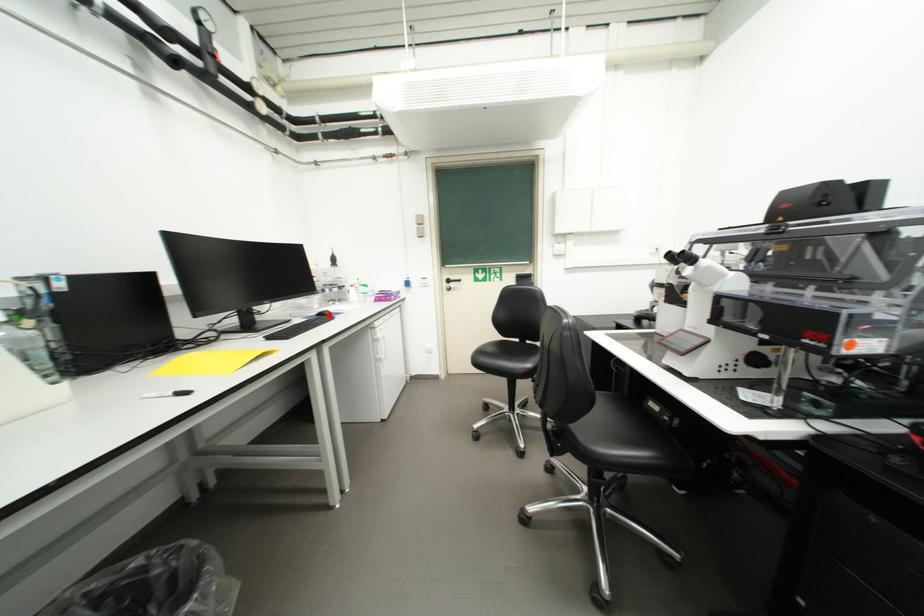
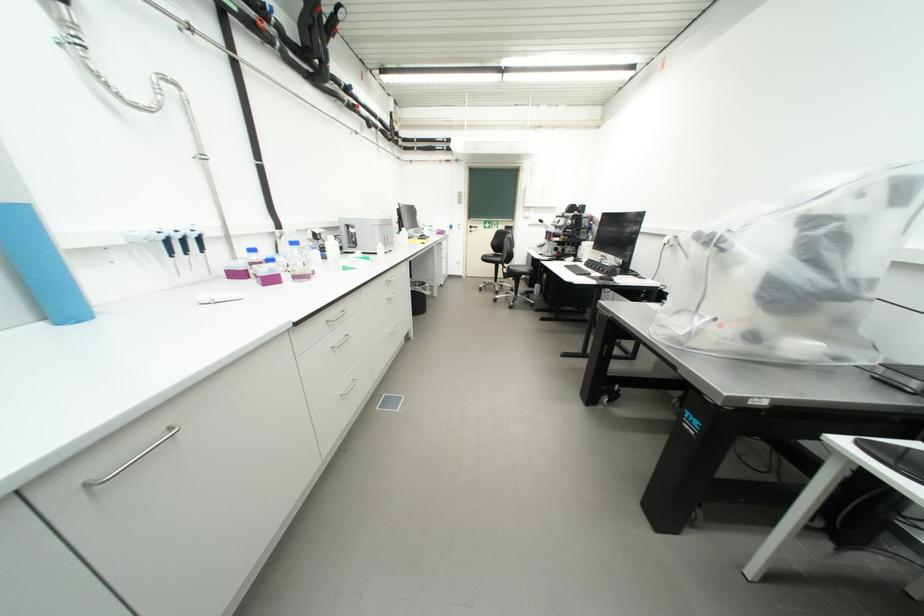
Question: I am providing you with two images of the same scene from different viewpoints. A red point is marked on the first image. Can you still see the location of the red point in image 2?

Choices:
 (A) Yes
 (B) No

Answer: (B)